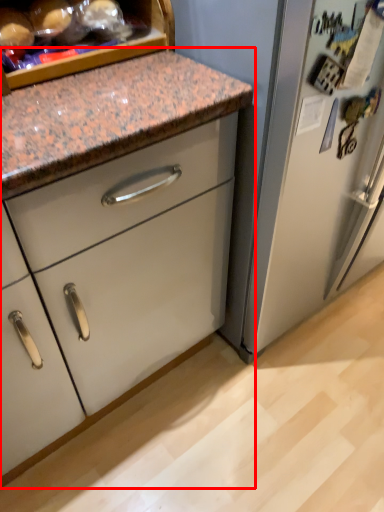
Question: Considering the relative positions of cabinetry (annotated by the red box) and food in the image provided, where is cabinetry (annotated by the red box) located with respect to the staircase?

Choices:
 (A) right
 (B) left

Answer: (A)